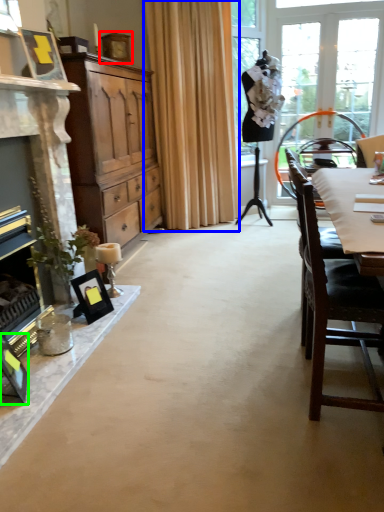
Question: Which is nearer to the picture frame (highlighted by a red box)? curtain (highlighted by a blue box) or picture frame (highlighted by a green box).

Choices:
 (A) curtain
 (B) picture frame

Answer: (A)